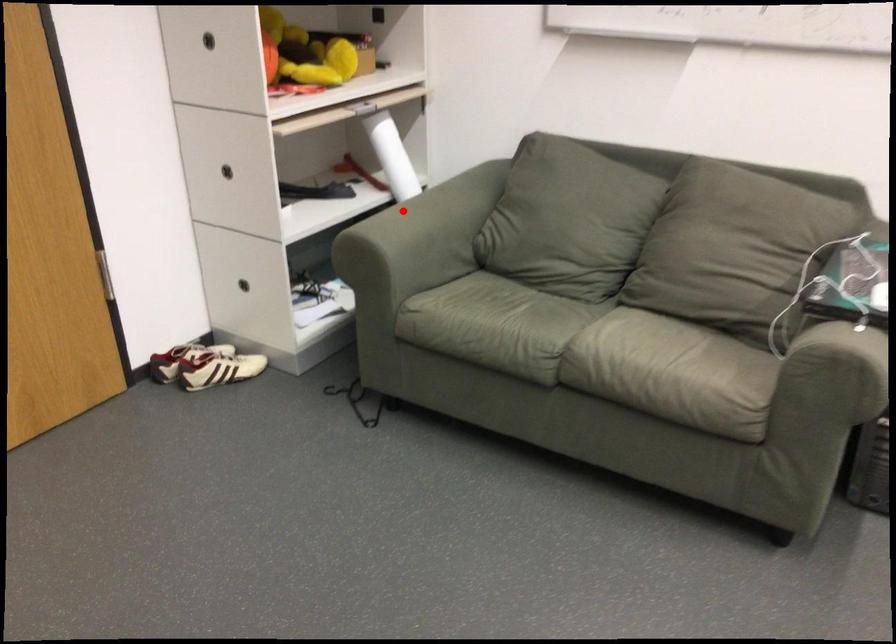
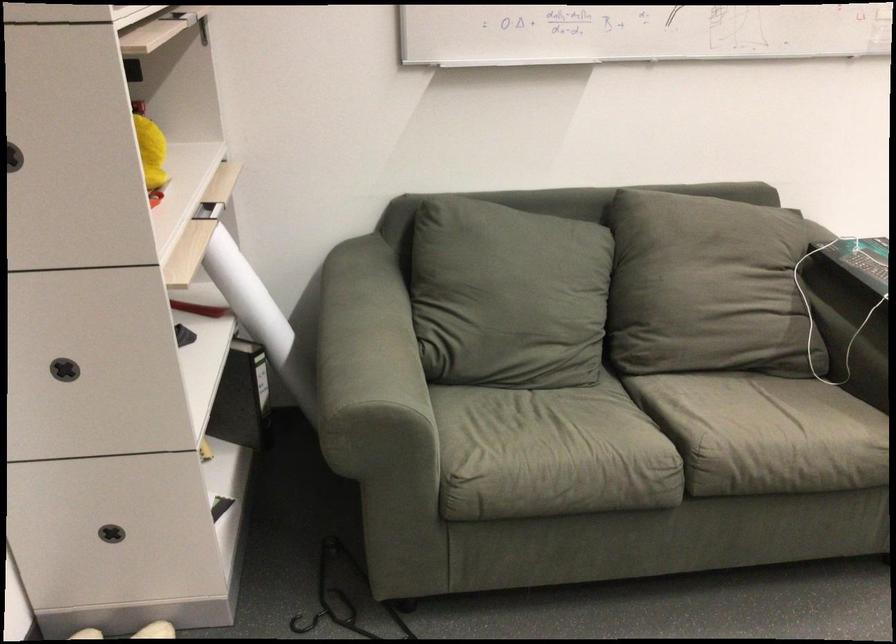
Where in the second image is the point corresponding to the highlighted location from the first image?

(358, 342)